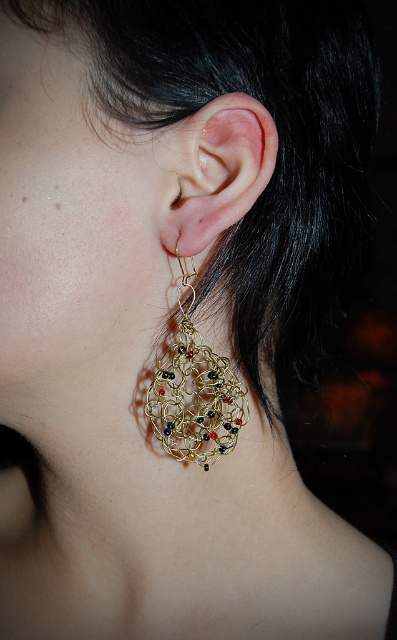
Question: Among these objects, which one is farthest from the camera?

Choices:
 (A) gold wire mesh earring at lower left
 (B) matte gold earring at center

Answer: (A)

Question: Which of the following is the farthest from the observer?

Choices:
 (A) gold wire mesh earring at lower left
 (B) matte gold earring at center

Answer: (A)

Question: Is matte gold earring at center further to camera compared to gold wire mesh earring at lower left?

Choices:
 (A) no
 (B) yes

Answer: (A)

Question: Among these objects, which one is nearest to the camera?

Choices:
 (A) matte gold earring at center
 (B) gold wire mesh earring at lower left

Answer: (A)

Question: Considering the relative positions of matte gold earring at center and gold wire mesh earring at lower left in the image provided, where is matte gold earring at center located with respect to gold wire mesh earring at lower left?

Choices:
 (A) above
 (B) below

Answer: (A)

Question: Is matte gold earring at center to the right of gold wire mesh earring at lower left from the viewer's perspective?

Choices:
 (A) yes
 (B) no

Answer: (A)